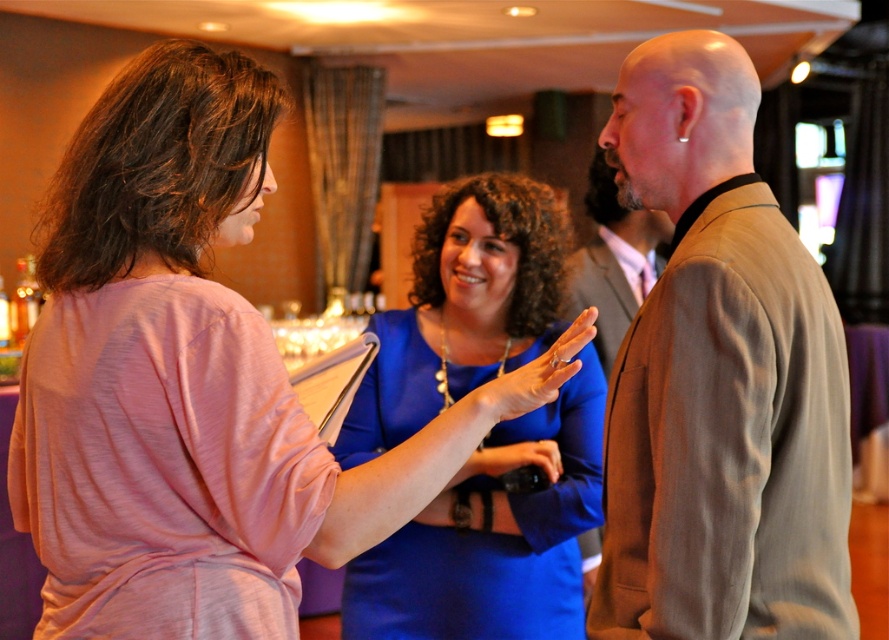
You are a photographer at this event and need to take a photo of the two people wearing the brown textured suit at center and holding the matte black camera at center. Since the camera can only focus on one subject at a time, which subject should you prioritize to ensure it is in focus given their sizes?

The brown textured suit at center is bigger than the matte black camera at center, so you should prioritize focusing on the brown textured suit at center to ensure it is in focus.